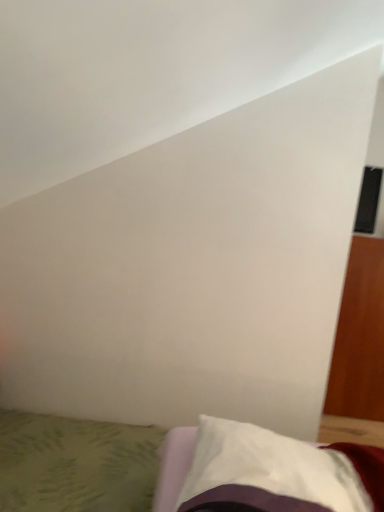
Question: In the image, is white soft pillow at lower right positioned in front of or behind white fabric bed at lower center?

Choices:
 (A) behind
 (B) front

Answer: (B)

Question: Is white soft pillow at lower right situated inside white fabric bed at lower center or outside?

Choices:
 (A) inside
 (B) outside

Answer: (B)

Question: From a real-world perspective, is white soft pillow at lower right above or below white fabric bed at lower center?

Choices:
 (A) above
 (B) below

Answer: (A)

Question: In the image, is white fabric bed at lower center on the left side or the right side of white soft pillow at lower right?

Choices:
 (A) right
 (B) left

Answer: (B)

Question: Looking at their shapes, would you say white fabric bed at lower center is wider or thinner than white soft pillow at lower right?

Choices:
 (A) thin
 (B) wide

Answer: (B)

Question: From the image's perspective, relative to white soft pillow at lower right, is white fabric bed at lower center above or below?

Choices:
 (A) above
 (B) below

Answer: (B)

Question: Choose the correct answer: Is white fabric bed at lower center inside white soft pillow at lower right or outside it?

Choices:
 (A) outside
 (B) inside

Answer: (A)